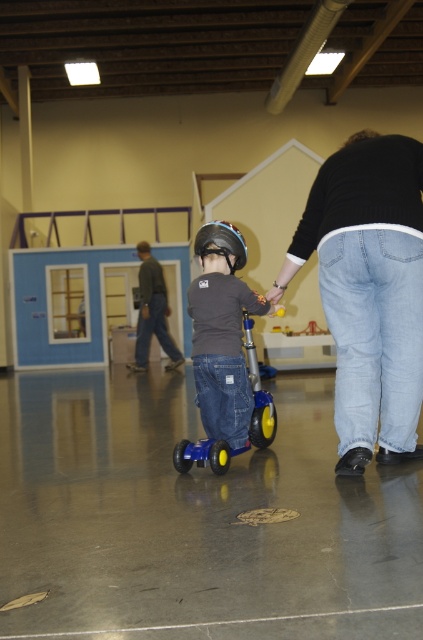
Who is positioned more to the right, jeans at center or black matte helmet at center?

jeans at center is more to the right.

Is jeans at center thinner than black matte helmet at center?

No, jeans at center is not thinner than black matte helmet at center.

Find the location of a particular element. jeans at center is located at coordinates (368, 291).

Can you confirm if jeans at center is wider than dark gray helmet at center?

No.

Does point (392, 193) come farther from viewer compared to point (139, 296)?

No, (392, 193) is closer to viewer.

Between point (277, 284) and point (165, 330), which one is positioned behind?

The point (165, 330) is behind.

Where is `jeans at center`? The width and height of the screenshot is (423, 640). jeans at center is located at coordinates (368, 291).

Which is above, matte black helmet at center or dark gray helmet at center?

dark gray helmet at center

Does matte black helmet at center have a larger size compared to dark gray helmet at center?

Actually, matte black helmet at center might be smaller than dark gray helmet at center.

Describe the element at coordinates (222, 332) in the screenshot. I see `matte black helmet at center` at that location.

You are a GUI agent. You are given a task and a screenshot of the screen. Output one action in this format:
    pyautogui.click(x=<x>, y=<y>)
    Task: Click on the matte black helmet at center
    This screenshot has height=640, width=423.
    Given the screenshot: What is the action you would take?
    pyautogui.click(x=222, y=332)